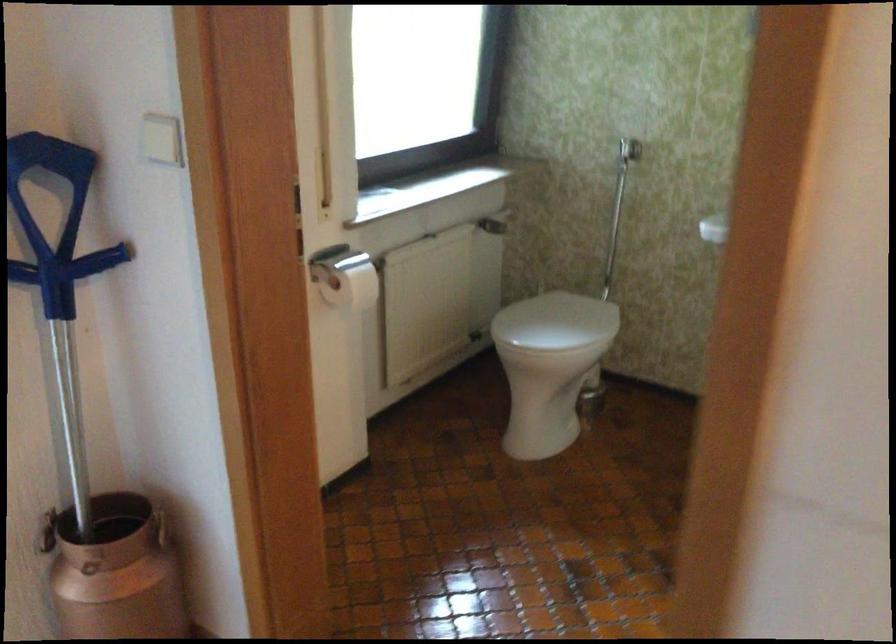
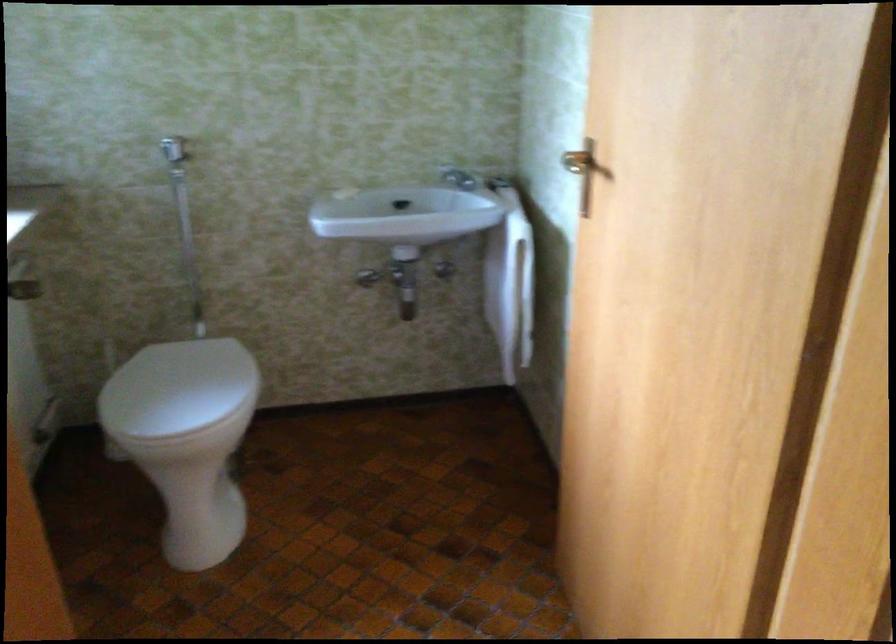
Find the pixel in the second image that matches (548,319) in the first image.

(177, 388)